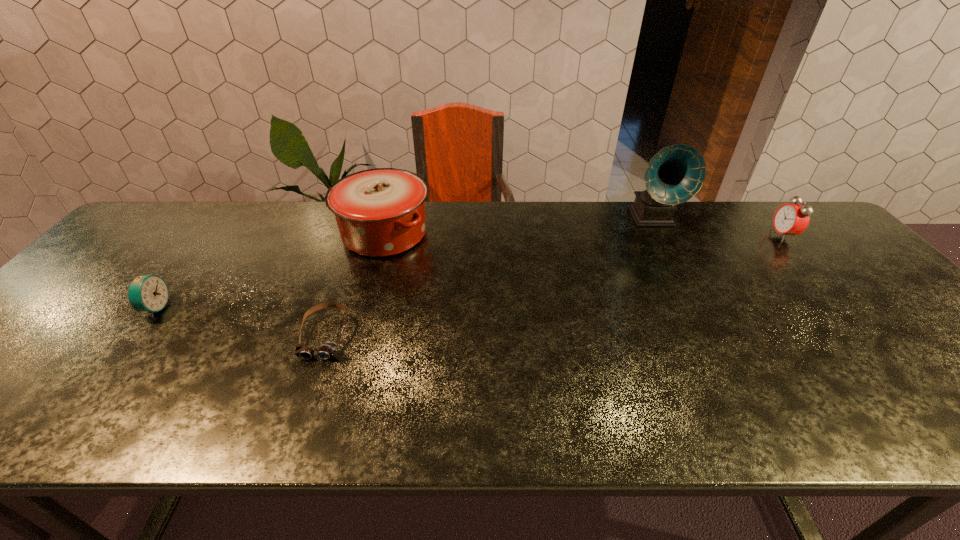
I want to click on free space located 0.170m on the front-facing side of the third shortest object, so click(x=716, y=236).

Locate an element on the screen. The height and width of the screenshot is (540, 960). vacant space located 0.180m on the front-facing side of the third shortest object is located at coordinates coord(713,236).

This screenshot has width=960, height=540. I want to click on vacant space situated on the front-facing side of the third shortest object, so click(x=657, y=236).

Find the location of a particular element. Image resolution: width=960 pixels, height=540 pixels. free spot located 0.080m on the front-facing side of the shorter alarm clock is located at coordinates (199, 308).

I want to click on vacant space located 0.080m on the front-facing side of the shortest object, so click(x=305, y=391).

This screenshot has height=540, width=960. Identify the location of phonograph_record positioned at the far edge. (675, 174).

Locate an element on the screen. The image size is (960, 540). casserole that is at the far edge is located at coordinates (380, 212).

Find the location of `alarm clock that is at the far edge`. alarm clock that is at the far edge is located at coordinates (791, 219).

The image size is (960, 540). Find the location of `object present at the right edge`. object present at the right edge is located at coordinates click(x=791, y=219).

Identify the location of object positioned at the far right corner. (791, 219).